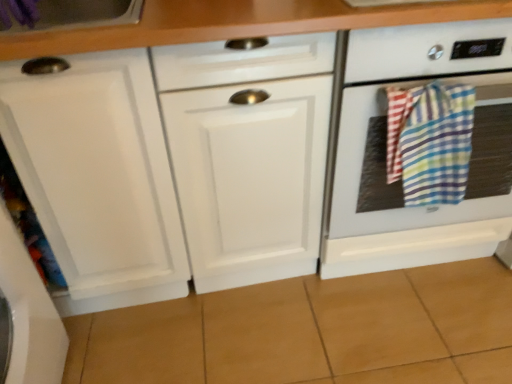
Describe the element at coordinates (430, 142) in the screenshot. I see `multicolored plaid towel at right` at that location.

Where is `multicolored plaid towel at right`? multicolored plaid towel at right is located at coordinates (430, 142).

The width and height of the screenshot is (512, 384). Find the location of `white glossy oven at right`. white glossy oven at right is located at coordinates (409, 160).

This screenshot has width=512, height=384. What do you see at coordinates (409, 160) in the screenshot?
I see `white glossy oven at right` at bounding box center [409, 160].

This screenshot has height=384, width=512. Identify the location of multicolored plaid towel at right. (430, 142).

Considering the relative positions of white glossy oven at right and multicolored plaid towel at right in the image provided, is white glossy oven at right to the right of multicolored plaid towel at right from the viewer's perspective?

Indeed, white glossy oven at right is positioned on the right side of multicolored plaid towel at right.

In the image, is white glossy oven at right positioned in front of or behind multicolored plaid towel at right?

white glossy oven at right is in front of multicolored plaid towel at right.

Which is less distant, (454,237) or (473,122)?

Clearly, point (454,237) is more distant from the camera than point (473,122).

From the image's perspective, is white glossy oven at right positioned above or below multicolored plaid towel at right?

white glossy oven at right is situated higher than multicolored plaid towel at right in the image.

From a real-world perspective, is white glossy oven at right over multicolored plaid towel at right?

No, from a real-world perspective, white glossy oven at right is not over multicolored plaid towel at right

Is white glossy oven at right thinner than multicolored plaid towel at right?

No, white glossy oven at right is not thinner than multicolored plaid towel at right.

Considering the sizes of objects white glossy oven at right and multicolored plaid towel at right in the image provided, who is shorter, white glossy oven at right or multicolored plaid towel at right?

With less height is multicolored plaid towel at right.

In the scene shown: Who is bigger, white glossy oven at right or multicolored plaid towel at right?

Bigger between the two is white glossy oven at right.

Is white glossy oven at right inside or outside of multicolored plaid towel at right?

white glossy oven at right is located beyond the bounds of multicolored plaid towel at right.

Are white glossy oven at right and multicolored plaid towel at right far apart?

No, there isn't a large distance between white glossy oven at right and multicolored plaid towel at right.

Is multicolored plaid towel at right at the back of white glossy oven at right?

Yes, white glossy oven at right's orientation is away from multicolored plaid towel at right.

Can you tell me how much white glossy oven at right and multicolored plaid towel at right differ in facing direction?

There is a 1.83-degree angle between the facing directions of white glossy oven at right and multicolored plaid towel at right.

The width and height of the screenshot is (512, 384). In order to click on beach towel above the white glossy oven at right (from a real-world perspective) in this screenshot , I will do `click(430, 142)`.

Considering the relative positions of multicolored plaid towel at right and white glossy oven at right in the image provided, is multicolored plaid towel at right to the left of white glossy oven at right from the viewer's perspective?

Correct, you'll find multicolored plaid towel at right to the left of white glossy oven at right.

Is multicolored plaid towel at right positioned before white glossy oven at right?

No.

Between point (407, 132) and point (416, 265), which one is positioned behind?

Point (416, 265)

From the image's perspective, is multicolored plaid towel at right over white glossy oven at right?

No, from the image's perspective, multicolored plaid towel at right is not above white glossy oven at right.

From a real-world perspective, which object rests below the other?

white glossy oven at right, from a real-world perspective.

Considering the sizes of objects multicolored plaid towel at right and white glossy oven at right in the image provided, who is wider, multicolored plaid towel at right or white glossy oven at right?

With larger width is white glossy oven at right.

Who is taller, multicolored plaid towel at right or white glossy oven at right?

white glossy oven at right.

Considering the sizes of objects multicolored plaid towel at right and white glossy oven at right in the image provided, who is bigger, multicolored plaid towel at right or white glossy oven at right?

white glossy oven at right.

Is multicolored plaid towel at right inside or outside of white glossy oven at right?

multicolored plaid towel at right is located beyond the bounds of white glossy oven at right.

Is multicolored plaid towel at right positioned far away from white glossy oven at right?

No, multicolored plaid towel at right is in close proximity to white glossy oven at right.

Consider the image. Is white glossy oven at right at the back of multicolored plaid towel at right?

Yes, multicolored plaid towel at right is facing away from white glossy oven at right.

Can you tell me how much multicolored plaid towel at right and white glossy oven at right differ in facing direction?

The facing directions of multicolored plaid towel at right and white glossy oven at right are 1.83 degrees apart.

How much distance is there between multicolored plaid towel at right and white glossy oven at right?

A distance of 4.57 inches exists between multicolored plaid towel at right and white glossy oven at right.

Identify the location of beach towel that appears on the left of white glossy oven at right. This screenshot has height=384, width=512. (430, 142).

This screenshot has height=384, width=512. In the image, there is a white glossy oven at right. In order to click on beach towel below it (from the image's perspective) in this screenshot , I will do `click(430, 142)`.

I want to click on beach towel located on the left of white glossy oven at right, so pos(430,142).